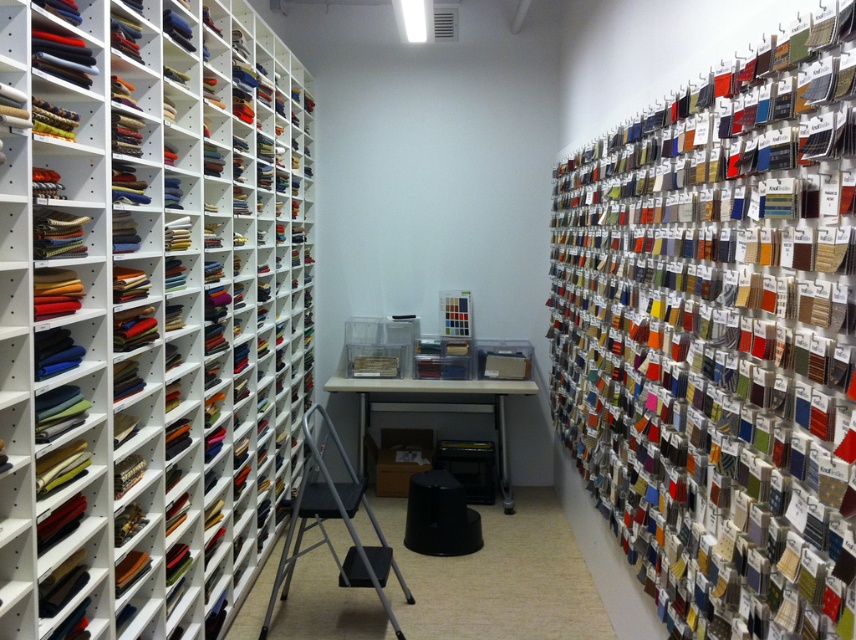
Does matte fabric bookshelf at left have a larger size compared to matte plastic bookshelf at right?

Correct, matte fabric bookshelf at left is larger in size than matte plastic bookshelf at right.

Who is higher up, matte fabric bookshelf at left or matte plastic bookshelf at right?

Positioned higher is matte fabric bookshelf at left.

Between point (9, 356) and point (697, 468), which one is positioned in front?

Point (9, 356)

At what (x,y) coordinates should I click in order to perform the action: click on matte fabric bookshelf at left. Please return your answer as a coordinate pair (x, y). This screenshot has width=856, height=640. Looking at the image, I should click on click(147, 308).

Is matte fabric bookshelf at left thinner than black plastic stool at center?

Indeed, matte fabric bookshelf at left has a lesser width compared to black plastic stool at center.

Does matte fabric bookshelf at left have a larger size compared to black plastic stool at center?

Indeed, matte fabric bookshelf at left has a larger size compared to black plastic stool at center.

Does point (158, 397) come closer to viewer compared to point (419, 552)?

That is True.

Identify the location of matte fabric bookshelf at left. (147, 308).

Consider the image. Who is more forward, [825,388] or [450,550]?

Point [825,388] is more forward.

How distant is matte plastic bookshelf at right from black plastic stool at center?

matte plastic bookshelf at right and black plastic stool at center are 4.82 feet apart.

Locate an element on the screen. matte plastic bookshelf at right is located at coordinates (720, 337).

You are a GUI agent. You are given a task and a screenshot of the screen. Output one action in this format:
    pyautogui.click(x=<x>, y=<y>)
    Task: Click on the matte plastic bookshelf at right
    The width and height of the screenshot is (856, 640).
    Given the screenshot: What is the action you would take?
    pyautogui.click(x=720, y=337)